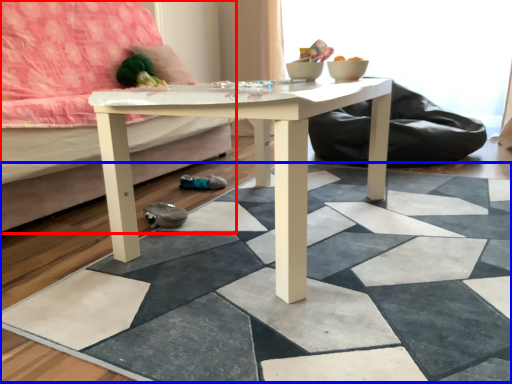
Question: Which point is further to the camera, studio couch (highlighted by a red box) or tile (highlighted by a blue box)?

Choices:
 (A) studio couch
 (B) tile

Answer: (A)